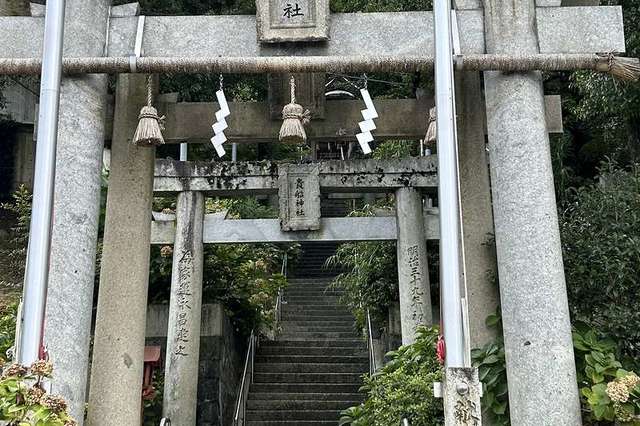
Identify the location of stairs. (313, 392), (307, 356), (317, 318), (307, 261), (324, 248).